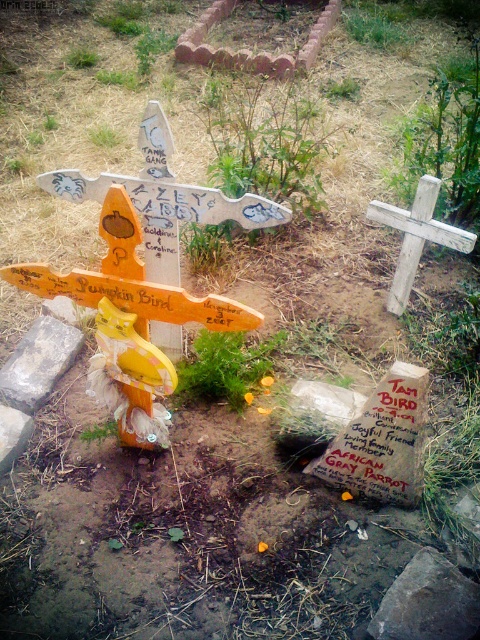
You are designing a layout for a small garden and have two items to place. You have a smooth gray rock at lower right and a weathered wood cross at upper right. Which item has a smaller width?

The smooth gray rock at lower right has a smaller width than the weathered wood cross at upper right.

You are standing at the center of the memorial area. You see the smooth gray rock at lower right and the smooth gray stone at lower left. Which one is positioned lower in the scene?

The smooth gray rock at lower right is positioned lower than the smooth gray stone at lower left.